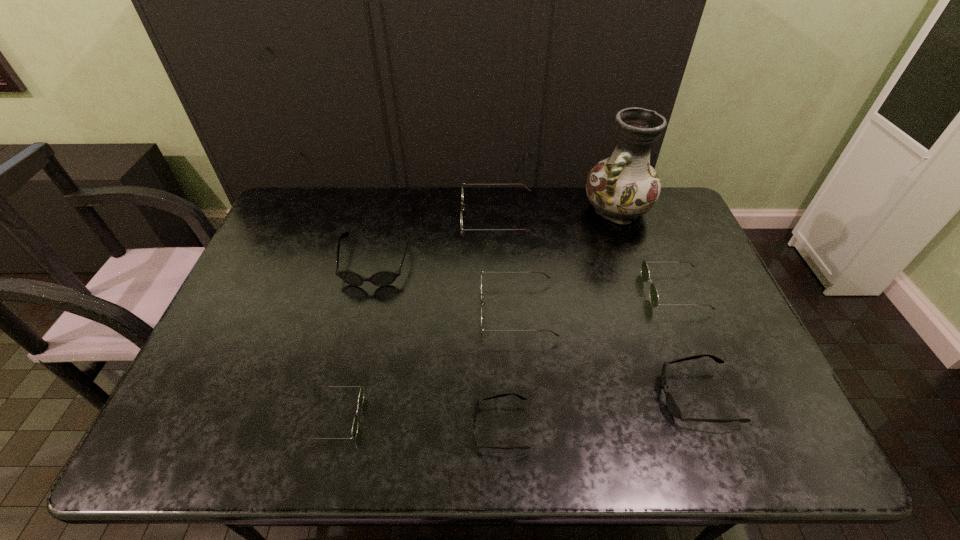
In order to click on vase at the far edge in this screenshot , I will do `click(622, 187)`.

This screenshot has height=540, width=960. I want to click on sunglasses located in the far edge section of the desktop, so point(528,189).

I want to click on vase present at the right edge, so click(622, 187).

You are a GUI agent. You are given a task and a screenshot of the screen. Output one action in this format:
    pyautogui.click(x=<x>, y=<y>)
    Task: Click on the object situated at the far right corner
    This screenshot has width=960, height=540.
    Given the screenshot: What is the action you would take?
    pyautogui.click(x=622, y=187)

Image resolution: width=960 pixels, height=540 pixels. What are the coordinates of `object at the near right corner` in the screenshot? It's located at (673, 407).

You are a GUI agent. You are given a task and a screenshot of the screen. Output one action in this format:
    pyautogui.click(x=<x>, y=<y>)
    Task: Click on the free space at the far edge of the desktop
    This screenshot has height=540, width=960.
    Given the screenshot: What is the action you would take?
    pyautogui.click(x=427, y=228)

Locate an element on the screen. Image resolution: width=960 pixels, height=540 pixels. free location at the left edge of the desktop is located at coordinates (268, 289).

Where is `blank space at the right edge`? blank space at the right edge is located at coordinates (667, 238).

Image resolution: width=960 pixels, height=540 pixels. In the image, there is a desktop. In order to click on blank space at the far left corner in this screenshot , I will do `click(309, 213)`.

In the image, there is a desktop. What are the coordinates of `vacant area at the near right corner` in the screenshot? It's located at (774, 458).